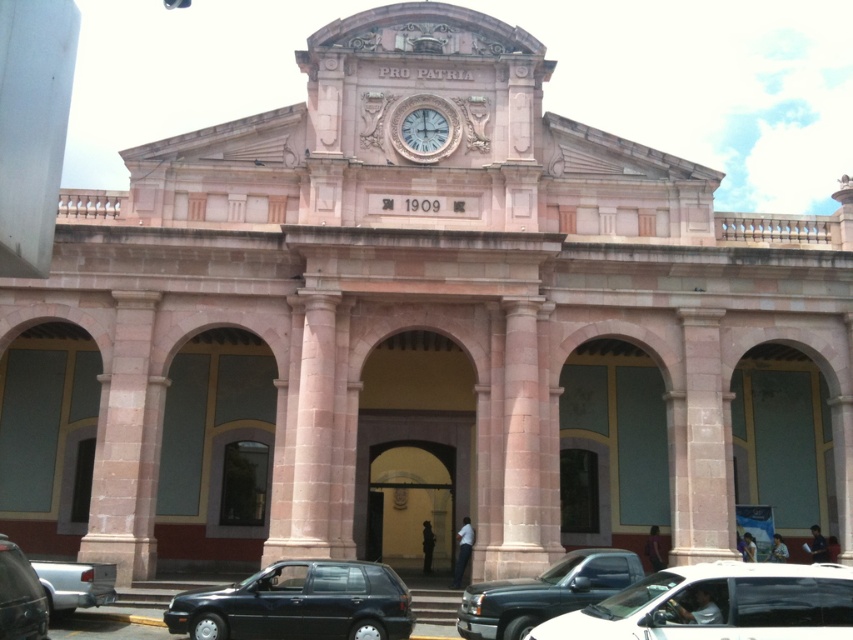
You are a pedestrian standing in front of the grand neoclassical building and want to cross the street. You see a metallic gray car at lower left and a silver metallic truck at lower left. Which vehicle is taller?

The metallic gray car at lower left is taller than the silver metallic truck at lower left.

You are a photographer planning to take a picture of the grand neoclassical building. You notice two cars in the foreground that might obstruct the view. The cars are the matte black car at center and the metallic gray car at lower left. Which car is more likely to block the view of the inscription PRO PATRIA on the building?

The matte black car at center is taller than the metallic gray car at lower left, so it is more likely to block the view of the inscription PRO PATRIA on the building.

You are standing in front of the grand neoclassical building and see a metallic gray car at lower left and a silver metallic truck at lower left. Which vehicle is nearer to you?

The metallic gray car at lower left is closer to you than the silver metallic truck at lower left.